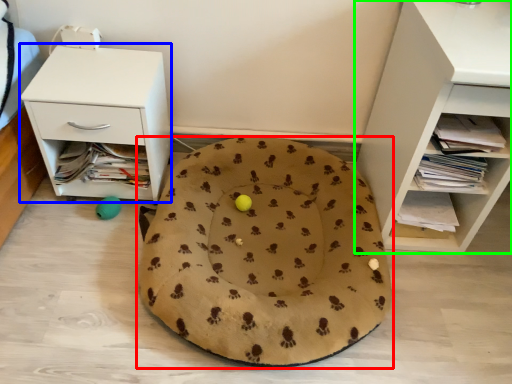
Question: Considering the real-world distances, which object is closest to dog bed (highlighted by a red box)? nightstand (highlighted by a blue box) or shelf (highlighted by a green box).

Choices:
 (A) nightstand
 (B) shelf

Answer: (A)